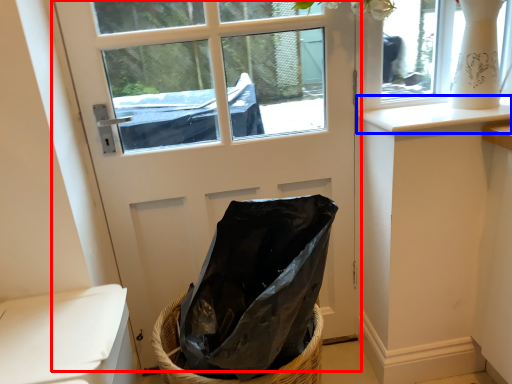
Question: Among these objects, which one is farthest to the camera, door (highlighted by a red box) or window sill (highlighted by a blue box)?

Choices:
 (A) door
 (B) window sill

Answer: (B)